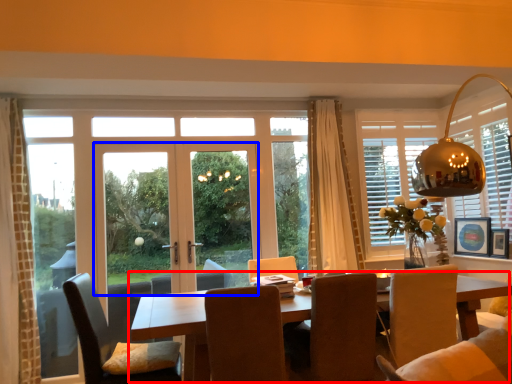
Question: Which of the following is the closest to the observer, kitchen & dining room table (highlighted by a red box) or door (highlighted by a blue box)?

Choices:
 (A) kitchen & dining room table
 (B) door

Answer: (A)